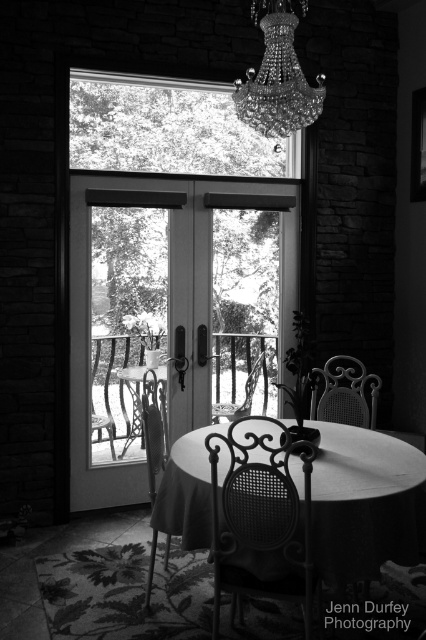
Question: Can you confirm if smooth matte black table at center is smaller than woven wicker chair at center?

Choices:
 (A) no
 (B) yes

Answer: (A)

Question: Which point is closer to the camera?

Choices:
 (A) woven rattan chair at lower center
 (B) metallic wrought iron chair at center

Answer: (A)

Question: Does metallic wrought iron chair at center have a greater width compared to woven wicker chair at center?

Choices:
 (A) yes
 (B) no

Answer: (B)

Question: Which object is farther from the camera taking this photo?

Choices:
 (A) woven rattan chair at lower center
 (B) woven wicker chair at center
 (C) metallic wrought iron table at center

Answer: (B)

Question: Is smooth matte black table at center bigger than metallic wrought iron table at center?

Choices:
 (A) no
 (B) yes

Answer: (B)

Question: Which of the following is the farthest from the observer?

Choices:
 (A) smooth matte black table at center
 (B) metallic wrought iron table at center

Answer: (B)